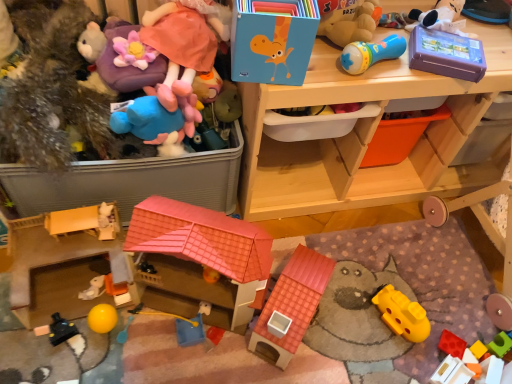
This screenshot has height=384, width=512. Find the location of `free space between rubberized plastic blocks at lower right, placed as the fourteenth toy when sorted from left to right, and blue plastic toy at center, the 8th toy viewed from the left`. free space between rubberized plastic blocks at lower right, placed as the fourteenth toy when sorted from left to right, and blue plastic toy at center, the 8th toy viewed from the left is located at coordinates (340, 346).